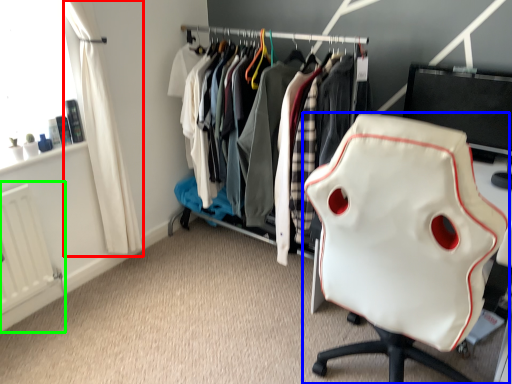
Question: Considering the real-world distances, which object is closest to curtain (highlighted by a red box)? chair (highlighted by a blue box) or radiator (highlighted by a green box).

Choices:
 (A) chair
 (B) radiator

Answer: (B)